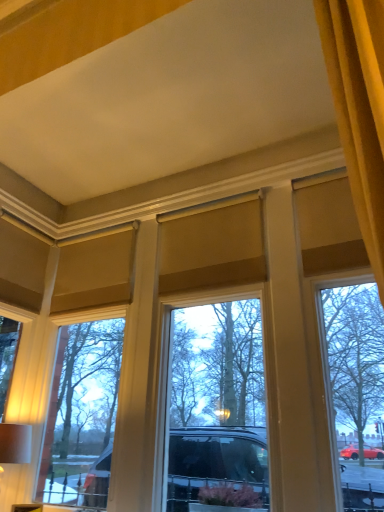
Question: Should I look upward or downward to see matte white table lamp at lower left?

Choices:
 (A) up
 (B) down

Answer: (B)

Question: From a real-world perspective, is matte glass window at center physically above matte white table lamp at lower left?

Choices:
 (A) yes
 (B) no

Answer: (A)

Question: Is matte glass window at center further to camera compared to matte white table lamp at lower left?

Choices:
 (A) no
 (B) yes

Answer: (A)

Question: Considering the relative sizes of matte glass window at center and matte white table lamp at lower left in the image provided, is matte glass window at center smaller than matte white table lamp at lower left?

Choices:
 (A) yes
 (B) no

Answer: (B)

Question: Is matte glass window at center surrounding matte white table lamp at lower left?

Choices:
 (A) yes
 (B) no

Answer: (B)

Question: Is matte glass window at center not within matte white table lamp at lower left?

Choices:
 (A) yes
 (B) no

Answer: (A)

Question: Is matte glass window at center directly adjacent to matte white table lamp at lower left?

Choices:
 (A) no
 (B) yes

Answer: (A)

Question: Is matte glass window at center surrounded by matte white table lamp at lower left?

Choices:
 (A) yes
 (B) no

Answer: (B)

Question: Does matte white table lamp at lower left turn towards matte glass window at center?

Choices:
 (A) yes
 (B) no

Answer: (B)

Question: Can you confirm if matte white table lamp at lower left is thinner than matte glass window at center?

Choices:
 (A) yes
 (B) no

Answer: (B)

Question: Is matte white table lamp at lower left outside matte glass window at center?

Choices:
 (A) no
 (B) yes

Answer: (B)

Question: Can you confirm if matte white table lamp at lower left is bigger than matte glass window at center?

Choices:
 (A) yes
 (B) no

Answer: (B)

Question: Does matte white table lamp at lower left touch matte glass window at center?

Choices:
 (A) no
 (B) yes

Answer: (A)

Question: Do you think matte white table lamp at lower left is within matte glass window at center, or outside of it?

Choices:
 (A) inside
 (B) outside

Answer: (B)